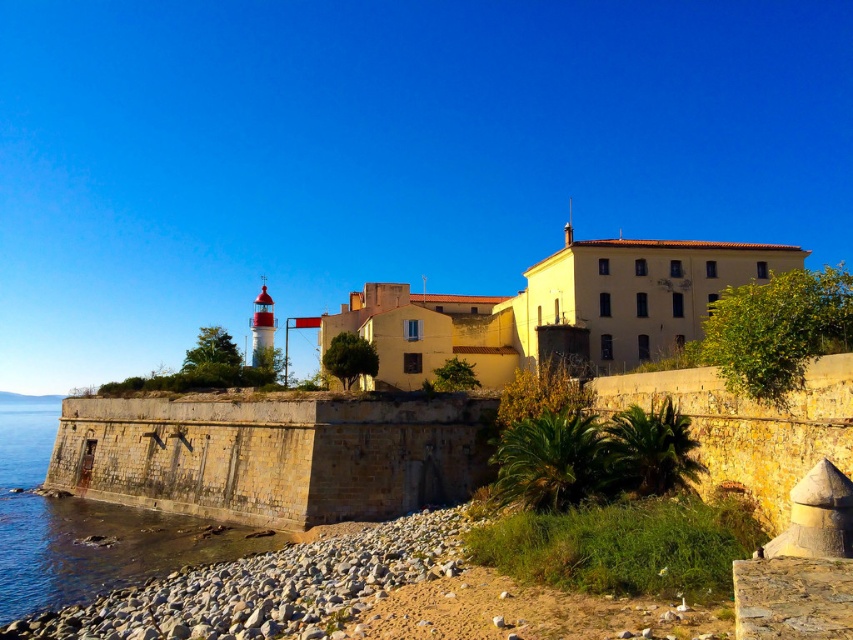
Is point (317, 618) positioned before point (178, 532)?

That is True.

Does gray gravel at lower left appear over gray stone water at lower left?

Yes, gray gravel at lower left is above gray stone water at lower left.

Between point (107, 596) and point (120, 538), which one is positioned in front?

Point (107, 596)

At what (x,y) coordinates should I click in order to perform the action: click on gray gravel at lower left. Please return your answer as a coordinate pair (x, y). This screenshot has height=640, width=853. Looking at the image, I should click on (267, 588).

How distant is yellow matte building at center from gray stone water at lower left?

yellow matte building at center is 46.94 meters from gray stone water at lower left.

Can you confirm if yellow matte building at center is positioned to the right of gray stone water at lower left?

Yes, yellow matte building at center is to the right of gray stone water at lower left.

Which is in front, point (577, 324) or point (117, 524)?

Point (117, 524)

Identify the location of yellow matte building at center. 556,308.

Looking at this image, does yellow matte building at center appear on the right side of gray gravel at lower left?

Correct, you'll find yellow matte building at center to the right of gray gravel at lower left.

Does yellow matte building at center appear under gray gravel at lower left?

Incorrect, yellow matte building at center is not positioned below gray gravel at lower left.

You are a GUI agent. You are given a task and a screenshot of the screen. Output one action in this format:
    pyautogui.click(x=<x>, y=<y>)
    Task: Click on the yellow matte building at center
    
    Given the screenshot: What is the action you would take?
    pyautogui.click(x=556, y=308)